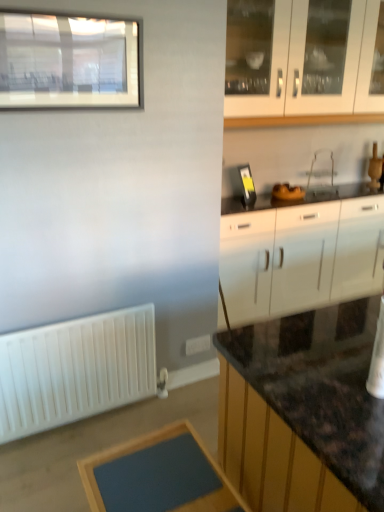
What is the approximate width of clear plastic sink at center?

It is 7.35 inches.

What do you see at coordinates (316, 66) in the screenshot?
I see `white glossy cabinet at upper right, marked as the second cabinetry in a bottom-to-top arrangement` at bounding box center [316, 66].

Locate an element on the screen. The height and width of the screenshot is (512, 384). white glossy cabinet at upper right, which ranks as the first cabinetry in top-to-bottom order is located at coordinates (316, 66).

I want to click on white glossy cabinet at right, which appears as the second cabinetry when viewed from the top, so click(300, 256).

Are white glossy cabinet at upper right, which ranks as the first cabinetry in top-to-bottom order, and matte glass window at upper left beside each other?

white glossy cabinet at upper right, which ranks as the first cabinetry in top-to-bottom order, and matte glass window at upper left are clearly separated.

Is white glossy cabinet at upper right, which ranks as the first cabinetry in top-to-bottom order, facing away from matte glass window at upper left?

No, white glossy cabinet at upper right, which ranks as the first cabinetry in top-to-bottom order, is not facing the opposite direction of matte glass window at upper left.

Is white glossy cabinet at upper right, marked as the second cabinetry in a bottom-to-top arrangement, outside of matte glass window at upper left?

Yes, white glossy cabinet at upper right, marked as the second cabinetry in a bottom-to-top arrangement, is outside of matte glass window at upper left.

From the picture: Is white matte radiator at lower left looking in the opposite direction of clear plastic sink at center?

No.

Considering the positions of points (113, 370) and (285, 194), is point (113, 370) closer to camera compared to point (285, 194)?

Yes.

Based on the photo, between white matte radiator at lower left and clear plastic sink at center, which one has larger width?

clear plastic sink at center is wider.

From the image's perspective, is white matte radiator at lower left located beneath clear plastic sink at center?

Yes.

Who is taller, clear plastic sink at center or white matte radiator at lower left?

white matte radiator at lower left.

Which object is further away from the camera taking this photo, clear plastic sink at center or white matte radiator at lower left?

clear plastic sink at center is behind.

Identify the location of radiator below the clear plastic sink at center (from the image's perspective). (75, 370).

Is clear plastic sink at center completely or partially outside of white matte radiator at lower left?

Yes, clear plastic sink at center is outside of white matte radiator at lower left.

Is matte glass window at upper left not near white matte radiator at lower left?

That's right, there is a large distance between matte glass window at upper left and white matte radiator at lower left.

Does point (78, 50) appear closer or farther from the camera than point (110, 344)?

Clearly, point (78, 50) is closer to the camera than point (110, 344).

Considering the sizes of objects matte glass window at upper left and white matte radiator at lower left in the image provided, who is taller, matte glass window at upper left or white matte radiator at lower left?

white matte radiator at lower left is taller.

In the scene shown: Is white plastic electric outlet at lower center at the back of white glossy cabinet at upper right, marked as the second cabinetry in a bottom-to-top arrangement?

white glossy cabinet at upper right, marked as the second cabinetry in a bottom-to-top arrangement, does not have its back to white plastic electric outlet at lower center.

Does white glossy cabinet at upper right, which ranks as the first cabinetry in top-to-bottom order, have a lesser width compared to white plastic electric outlet at lower center?

No, white glossy cabinet at upper right, which ranks as the first cabinetry in top-to-bottom order, is not thinner than white plastic electric outlet at lower center.

From the image's perspective, which is above, white glossy cabinet at upper right, which ranks as the first cabinetry in top-to-bottom order, or white plastic electric outlet at lower center?

white glossy cabinet at upper right, which ranks as the first cabinetry in top-to-bottom order.

Is white glossy cabinet at upper right, which ranks as the first cabinetry in top-to-bottom order, bigger or smaller than white plastic electric outlet at lower center?

In the image, white glossy cabinet at upper right, which ranks as the first cabinetry in top-to-bottom order, appears to be larger than white plastic electric outlet at lower center.

Considering the positions of objects white glossy cabinet at upper right, which ranks as the first cabinetry in top-to-bottom order, and white matte radiator at lower left in the image provided, who is more to the right, white glossy cabinet at upper right, which ranks as the first cabinetry in top-to-bottom order, or white matte radiator at lower left?

Positioned to the right is white glossy cabinet at upper right, which ranks as the first cabinetry in top-to-bottom order.

Is white glossy cabinet at upper right, which ranks as the first cabinetry in top-to-bottom order, positioned with its back to white matte radiator at lower left?

white glossy cabinet at upper right, which ranks as the first cabinetry in top-to-bottom order, does not have its back to white matte radiator at lower left.

From a real-world perspective, is white matte radiator at lower left positioned above or below white glossy cabinet at right, which appears as the second cabinetry when viewed from the top?

Clearly, from a real-world perspective, white matte radiator at lower left is below white glossy cabinet at right, which appears as the second cabinetry when viewed from the top.

Is white matte radiator at lower left to the left of white glossy cabinet at right, the first cabinetry positioned from the bottom, from the viewer's perspective?

Yes, white matte radiator at lower left is to the left of white glossy cabinet at right, the first cabinetry positioned from the bottom.

Is white matte radiator at lower left outside of white glossy cabinet at right, which appears as the second cabinetry when viewed from the top?

white matte radiator at lower left lies outside white glossy cabinet at right, which appears as the second cabinetry when viewed from the top,'s area.

At what (x,y) coordinates should I click in order to perform the action: click on window to the left of white glossy cabinet at upper right, which ranks as the first cabinetry in top-to-bottom order. Please return your answer as a coordinate pair (x, y). The image size is (384, 512). Looking at the image, I should click on click(x=68, y=62).

Where is `radiator located below the clear plastic sink at center (from the image's perspective)`? radiator located below the clear plastic sink at center (from the image's perspective) is located at coordinates (75, 370).

Considering their positions, is white plastic electric outlet at lower center positioned closer to white glossy cabinet at upper right, which ranks as the first cabinetry in top-to-bottom order, than white glossy cabinet at right, the first cabinetry positioned from the bottom?

white glossy cabinet at right, the first cabinetry positioned from the bottom, is closer to white glossy cabinet at upper right, which ranks as the first cabinetry in top-to-bottom order.

Based on their spatial positions, is white plastic electric outlet at lower center or clear plastic sink at center closer to white glossy cabinet at right, the first cabinetry positioned from the bottom?

Based on the image, clear plastic sink at center appears to be nearer to white glossy cabinet at right, the first cabinetry positioned from the bottom.

Looking at the image, which one is located closer to matte glass window at upper left, blue matte table at lower center or white glossy cabinet at upper right, which ranks as the first cabinetry in top-to-bottom order?

white glossy cabinet at upper right, which ranks as the first cabinetry in top-to-bottom order, is positioned closer to the anchor matte glass window at upper left.

Considering their positions, is white glossy cabinet at upper right, which ranks as the first cabinetry in top-to-bottom order, positioned further to clear plastic sink at center than white plastic electric outlet at lower center?

Among the two, white plastic electric outlet at lower center is located further to clear plastic sink at center.

When comparing their distances from matte glass window at upper left, does white plastic electric outlet at lower center or white matte radiator at lower left seem closer?

Among the two, white matte radiator at lower left is located nearer to matte glass window at upper left.

Which object lies further to the anchor point white plastic electric outlet at lower center, clear plastic sink at center or white glossy cabinet at right, which appears as the second cabinetry when viewed from the top?

Among the two, clear plastic sink at center is located further to white plastic electric outlet at lower center.

Looking at the image, which one is located closer to matte glass window at upper left, white matte radiator at lower left or blue matte table at lower center?

Based on the image, white matte radiator at lower left appears to be nearer to matte glass window at upper left.

Considering their positions, is white matte radiator at lower left positioned closer to white glossy cabinet at right, the first cabinetry positioned from the bottom, than white plastic electric outlet at lower center?

white plastic electric outlet at lower center is positioned closer to the anchor white glossy cabinet at right, the first cabinetry positioned from the bottom.

Locate an element on the screen. window located between blue matte table at lower center and clear plastic sink at center in the depth direction is located at coordinates (68, 62).

Find the location of a particular element. Image resolution: width=384 pixels, height=512 pixels. electric outlet between white glossy cabinet at upper right, which ranks as the first cabinetry in top-to-bottom order, and blue matte table at lower center from top to bottom is located at coordinates (198, 344).

This screenshot has height=512, width=384. What are the coordinates of `sink between white glossy cabinet at upper right, which ranks as the first cabinetry in top-to-bottom order, and blue matte table at lower center, in the vertical direction` in the screenshot? It's located at (287, 192).

Identify the location of radiator between blue matte table at lower center and clear plastic sink at center in the front-back direction. (75, 370).